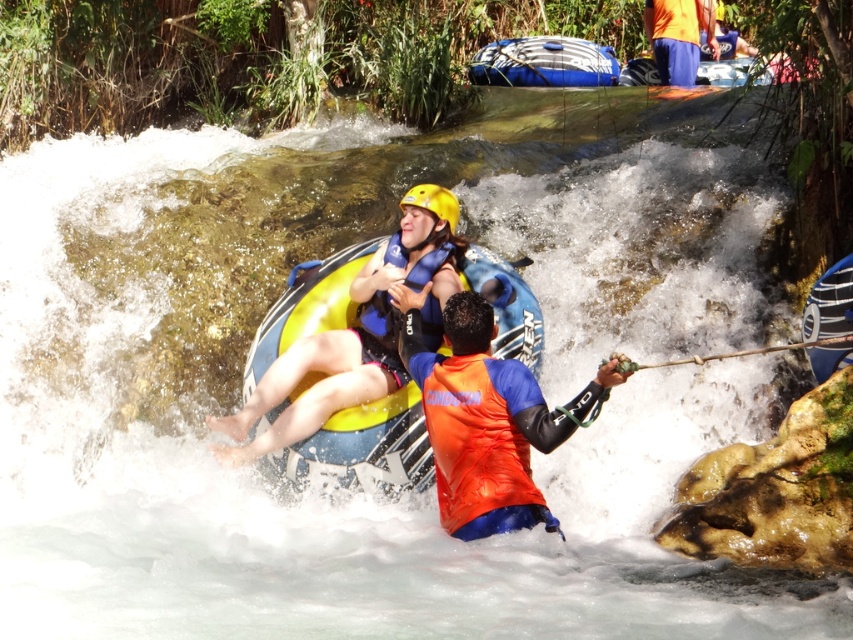
Question: Among these points, which one is nearest to the camera?

Choices:
 (A) (614, 378)
 (B) (809, 344)
 (C) (535, 390)

Answer: (A)

Question: Does yellow rubber tube at center appear on the right side of blue rubber kayak at upper center?

Choices:
 (A) yes
 (B) no

Answer: (B)

Question: Does yellow rubber tube at center have a smaller size compared to blue rubber kayak at upper center?

Choices:
 (A) no
 (B) yes

Answer: (B)

Question: Which is farther from the yellow rubber tube at center?

Choices:
 (A) wooden paddle at center
 (B) orange fabric shorts at upper right

Answer: (B)

Question: Can you confirm if yellow rubber tube at center is thinner than blue rubber kayak at upper center?

Choices:
 (A) yes
 (B) no

Answer: (A)

Question: Based on their relative distances, which object is farther from the orange fabric shorts at upper right?

Choices:
 (A) wooden paddle at center
 (B) yellow matte helmet at upper center
 (C) blue/neoprene life jacket at center

Answer: (C)